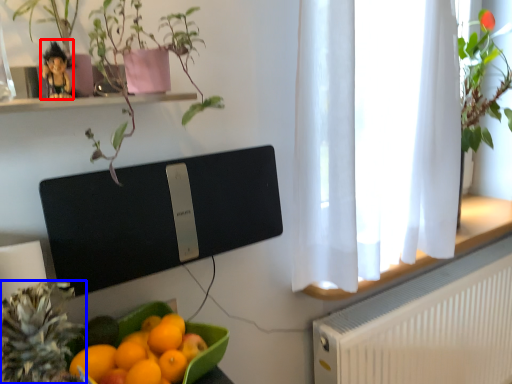
Question: Which point is closer to the camera, toy (highlighted by a red box) or pineapple (highlighted by a blue box)?

Choices:
 (A) toy
 (B) pineapple

Answer: (B)